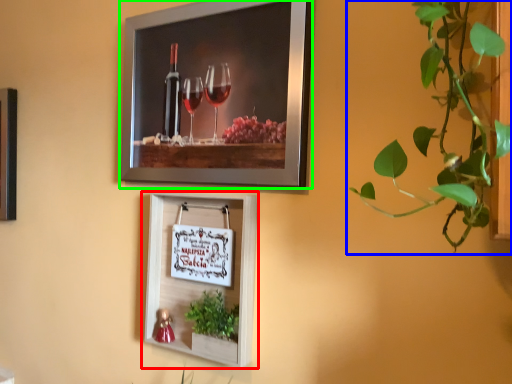
Question: Considering the real-world distances, which object is farthest from picture frame (highlighted by a red box)? houseplant (highlighted by a blue box) or picture frame (highlighted by a green box)?

Choices:
 (A) houseplant
 (B) picture frame

Answer: (A)